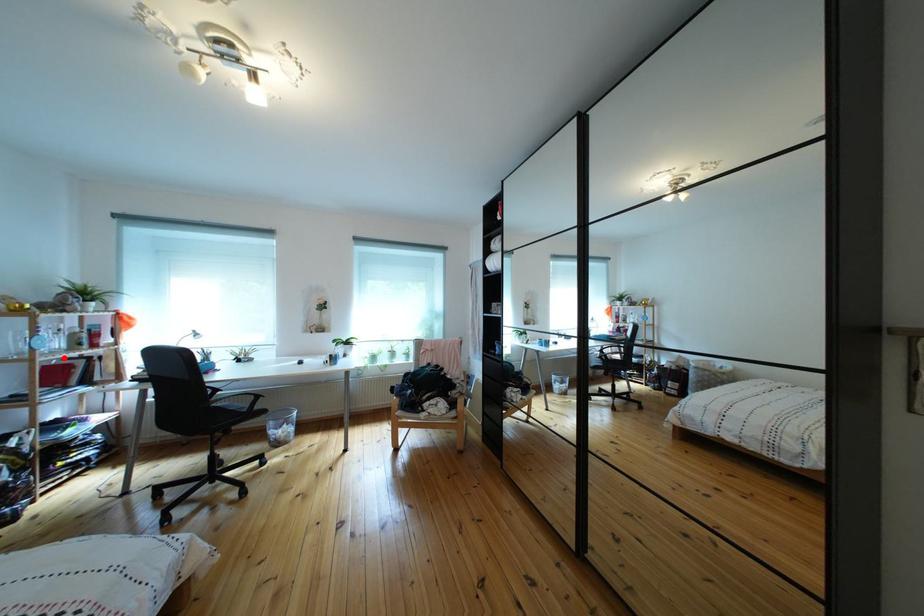
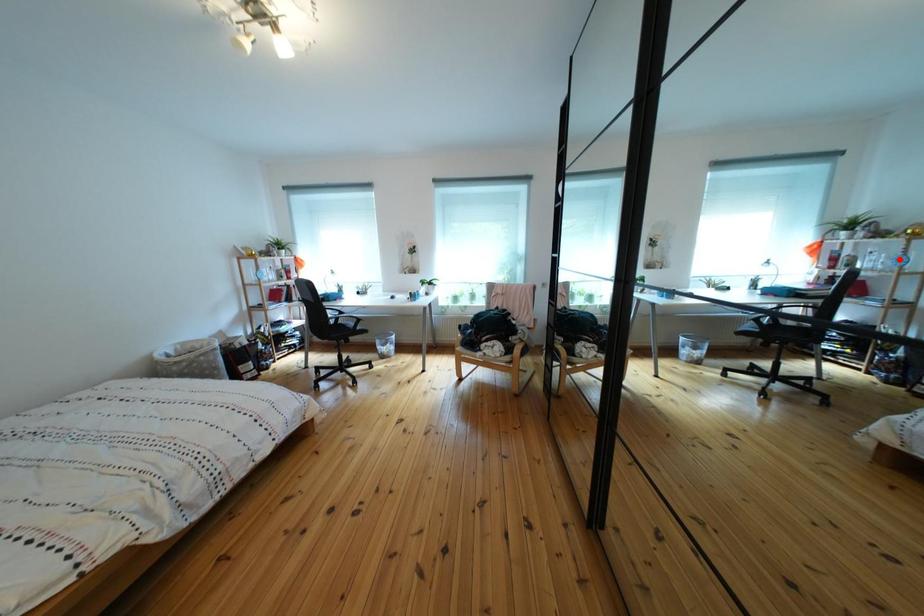
I am providing you with two images of the same scene from different viewpoints. A red point is marked on the first image and another point is marked on the second image. Are the points marked in image1 and image2 representing the same 3D position?

No